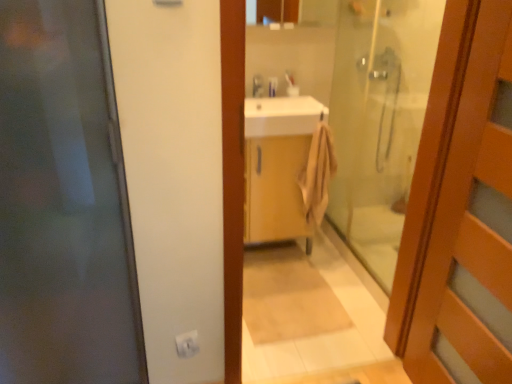
The height and width of the screenshot is (384, 512). I want to click on free region under wooden cabinet at center (from a real-world perspective), so click(276, 253).